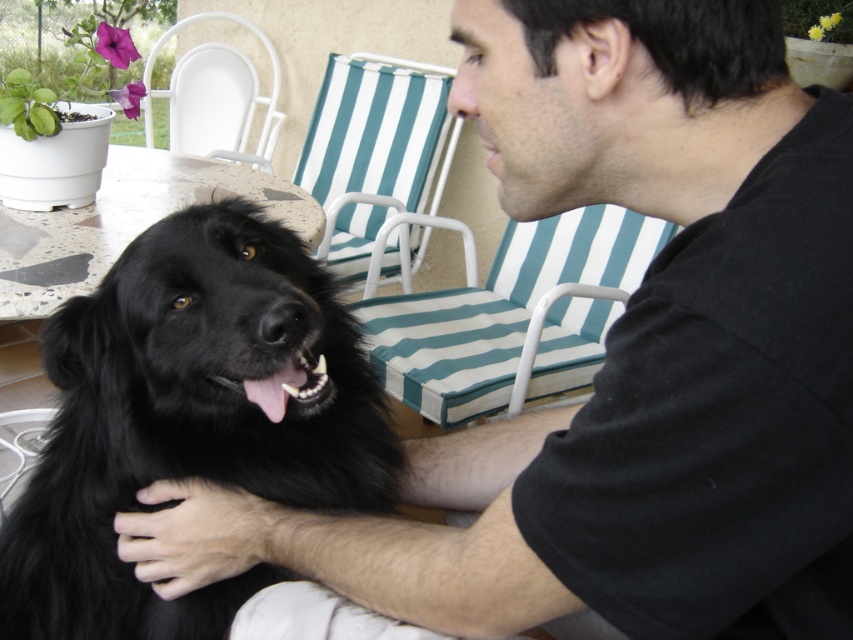
You are standing in the outdoor setting shown. There is a point at coordinates (514, 316). What object is located at that point?

The point at coordinates (514, 316) indicates the teal striped cushion at center.